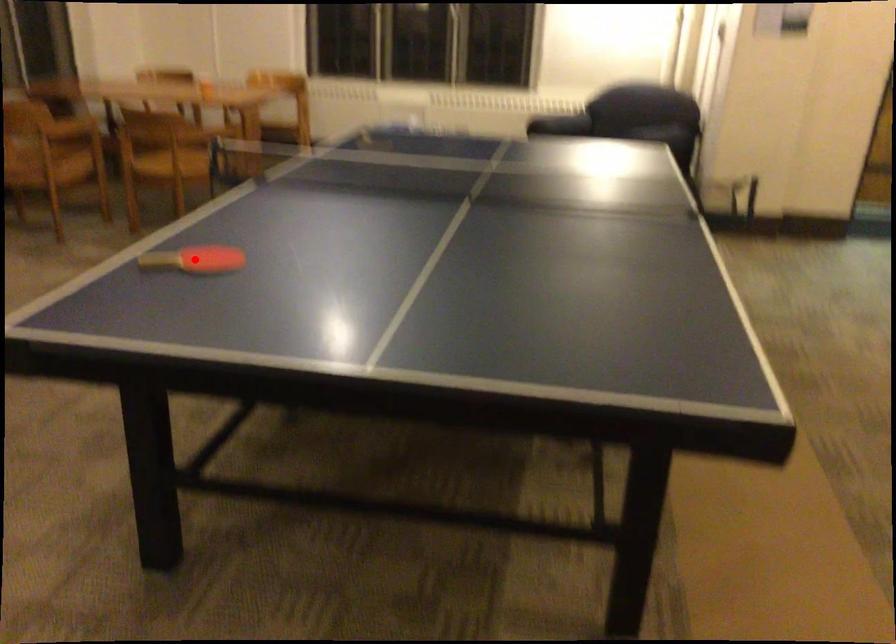
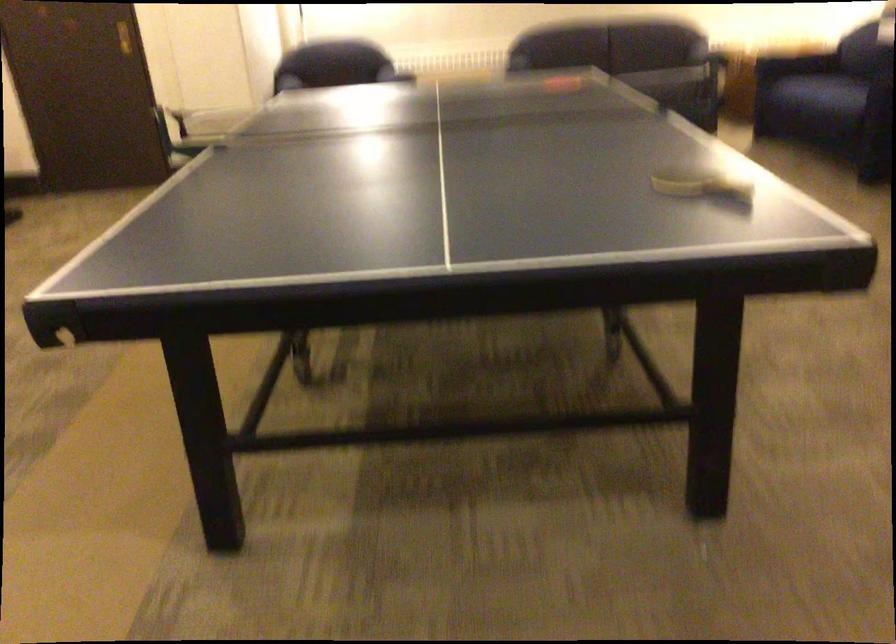
Question: I am providing you with two images of the same scene from different viewpoints. A red point is marked on the first image. Is the red point's position out of view in image 2?

Choices:
 (A) Yes
 (B) No

Answer: (A)